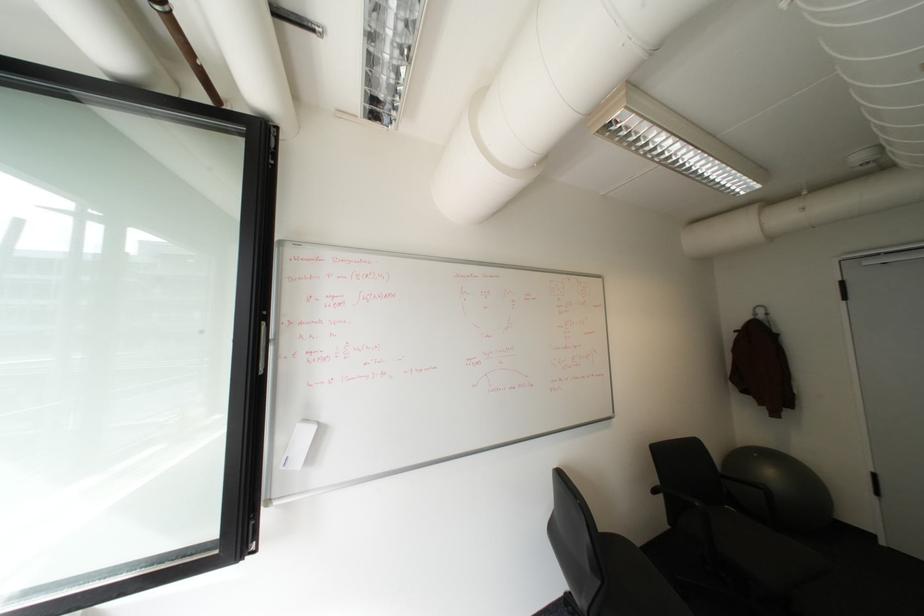
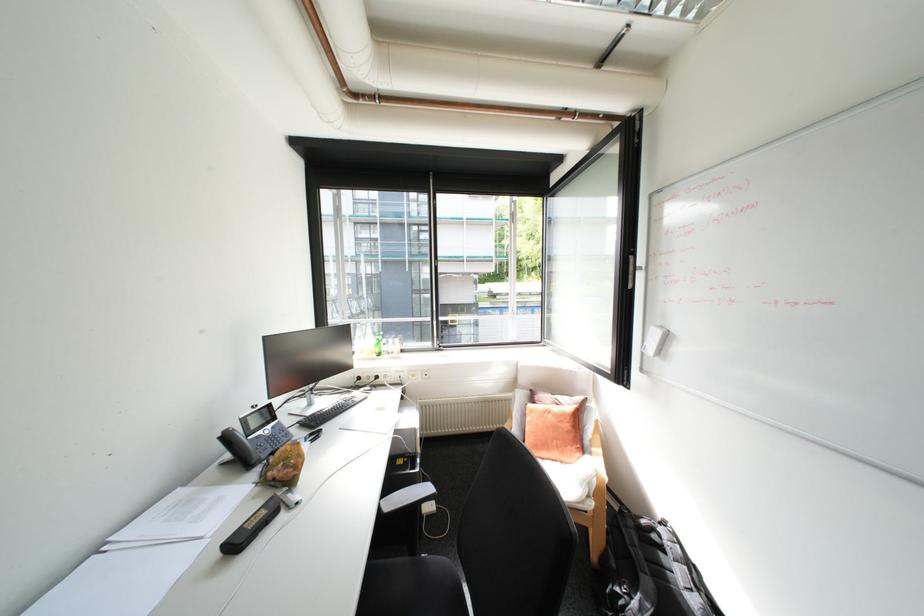
Question: Based on the continuous images, in which direction is the camera rotating? Reply with the corresponding letter.

Choices:
 (A) Left
 (B) Right
 (C) Up
 (D) Down

Answer: (A)